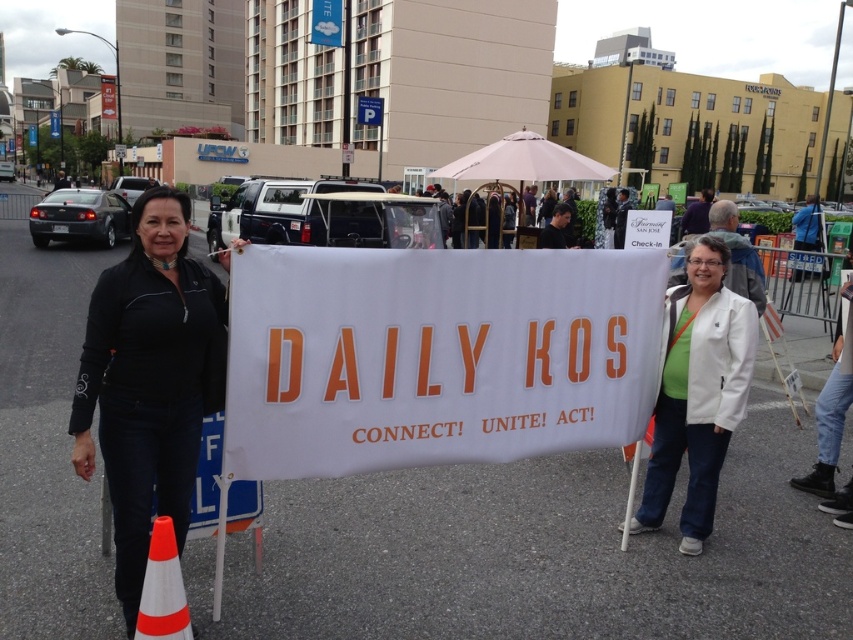
Is white paper banner at center to the right of orange and white plastic traffic cone at lower left from the viewer's perspective?

Correct, you'll find white paper banner at center to the right of orange and white plastic traffic cone at lower left.

Between white paper banner at center and orange and white plastic traffic cone at lower left, which one appears on the left side from the viewer's perspective?

From the viewer's perspective, orange and white plastic traffic cone at lower left appears more on the left side.

Image resolution: width=853 pixels, height=640 pixels. In order to click on white paper banner at center in this screenshot , I will do `click(434, 356)`.

Who is taller, black fabric at center or orange and white plastic traffic cone at lower left?

black fabric at center

Who is higher up, black fabric at center or orange and white plastic traffic cone at lower left?

Positioned higher is black fabric at center.

Find the location of `black fabric at center`. black fabric at center is located at coordinates (149, 381).

Can you confirm if white matte jacket at center is positioned below orange and white plastic traffic cone at lower left?

No.

Is white matte jacket at center thinner than orange and white plastic traffic cone at lower left?

No.

This screenshot has width=853, height=640. Identify the location of white matte jacket at center. (697, 392).

Identify the location of white matte jacket at center. (697, 392).